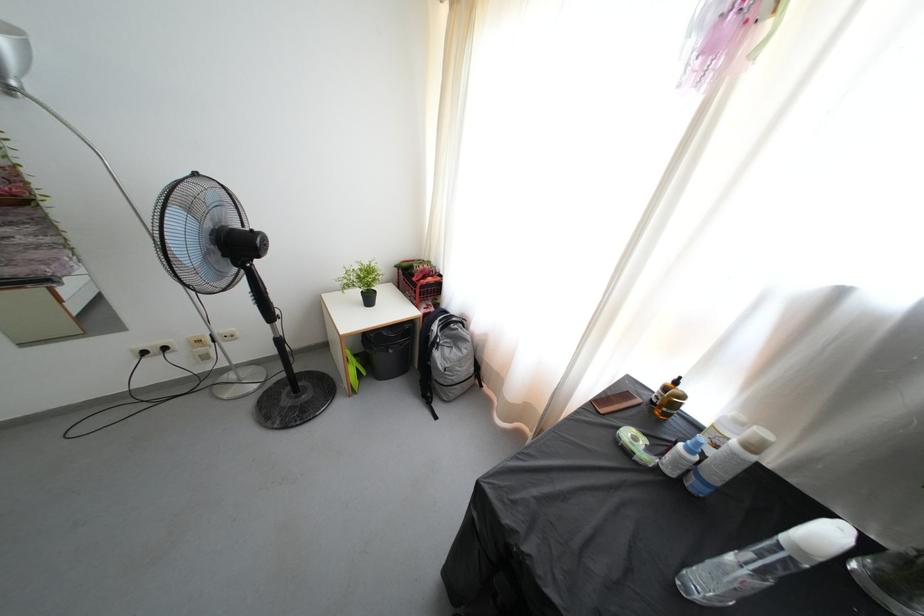
Where would you squeez the black dropper top? Please return your answer as a coordinate pair (x, y).

(892, 578)